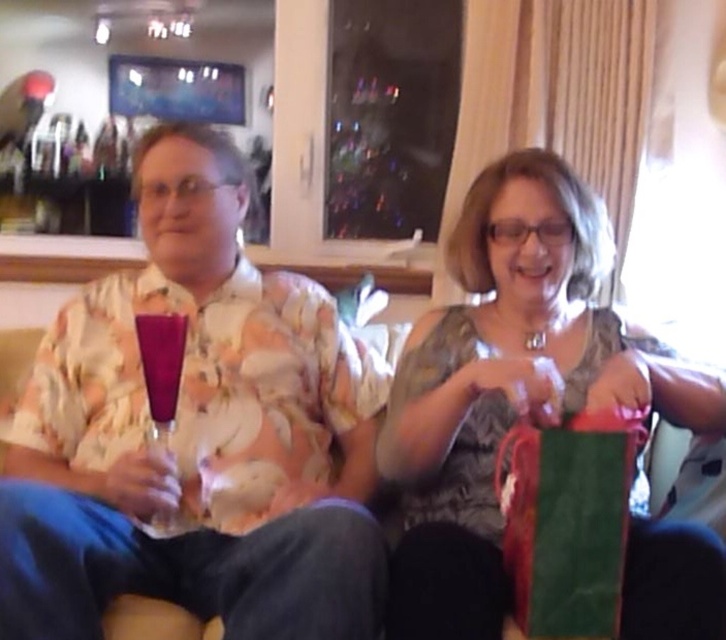
Question: Which is nearer to the green paper bag at center?

Choices:
 (A) transparent glass wine glass at center
 (B) floral shirt at left
 (C) matte purple glass at center

Answer: (B)

Question: Can you confirm if floral shirt at left is positioned to the left of green paper bag at center?

Choices:
 (A) no
 (B) yes

Answer: (B)

Question: Which of these objects is positioned farthest from the transparent glass wine glass at center?

Choices:
 (A) matte purple glass at center
 (B) floral shirt at left

Answer: (B)

Question: Can you confirm if green paper bag at center is positioned to the left of transparent glass wine glass at center?

Choices:
 (A) yes
 (B) no

Answer: (B)

Question: Can you confirm if floral shirt at left is positioned to the right of matte purple glass at center?

Choices:
 (A) yes
 (B) no

Answer: (A)

Question: Among these points, which one is farthest from the camera?

Choices:
 (A) (167, 349)
 (B) (179, 292)
 (C) (722, 573)
 (D) (163, 358)

Answer: (B)